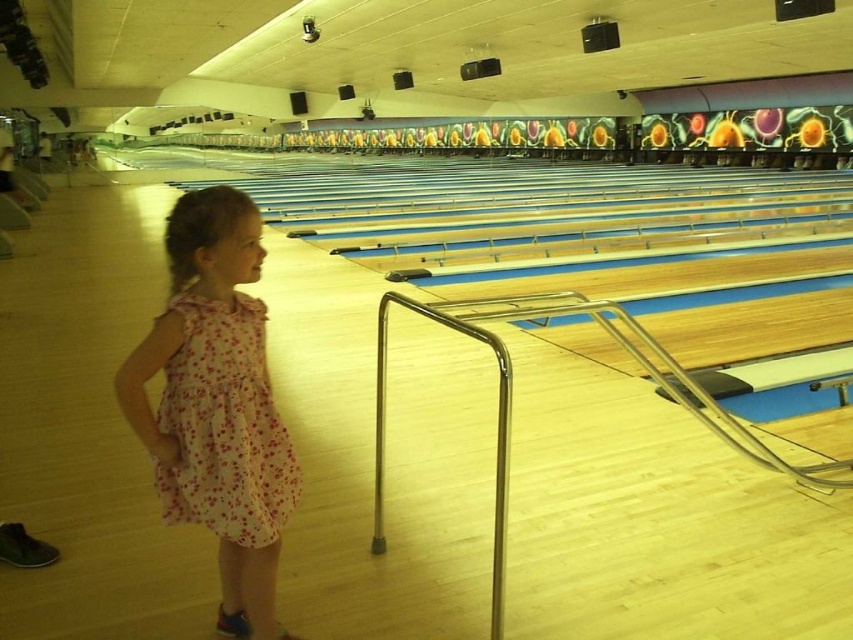
You are a photographer setting up for a family photo shoot at the bowling alley. You need to position two dresses in the scene so that one is visible above the other. Given the pink floral dress at center and the floral cotton dress at left, which dress should be placed higher to ensure visibility?

The pink floral dress at center should be placed higher since it is taller than the floral cotton dress at left, ensuring it remains visible above the shorter dress.

You are a photographer standing at the camera position in the bowling alley. You want to take a photo of the point at coordinates (236, 236). Is the young child wearing a sleeveless dress with a floral pattern in shades of pink and red, paired with dark shoes, blocking your view of the point? Please explain your reasoning.

The point at coordinates (236, 236) is 1.78 meters away from the camera. Since the young child is standing near the metal railing in the foreground and the point is located further away along the bowling lanes, the child is not blocking the view of the point. The distance between the camera and the point suggests the point is beyond the child, so the photographer can capture the point without obstruction.

You are a photographer trying to capture the pink floral dress at center in the bowling alley. The camera is set up at point A, which is at coordinates 0.5, 0.5. To ensure the dress is in the frame, should you adjust the camera position to be closer to the dress or move it further away?

The pink floral dress at center is located at coordinates (216, 403), which is to the right and slightly above the camera position at (426, 320). To include the dress in the frame, the photographer should move the camera closer to the dress to ensure it is centered.